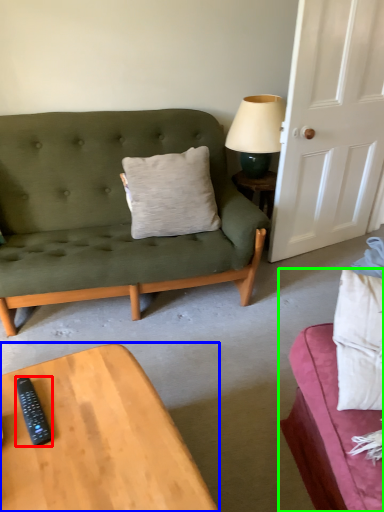
Question: Based on their relative distances, which object is nearer to remote control (highlighted by a red box)? Choose from coffee table (highlighted by a blue box) and studio couch (highlighted by a green box).

Choices:
 (A) coffee table
 (B) studio couch

Answer: (A)